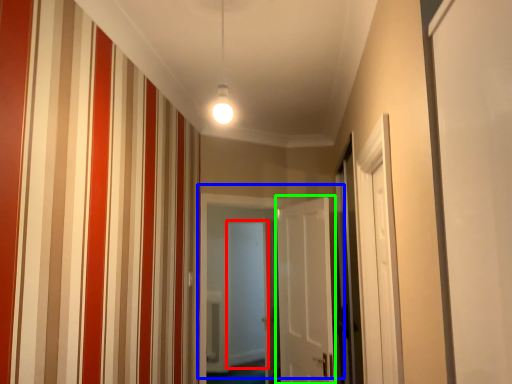
Question: Considering the real-world distances, which object is closest to screen door (highlighted by a red box)? door (highlighted by a blue box) or door (highlighted by a green box).

Choices:
 (A) door
 (B) door

Answer: (B)